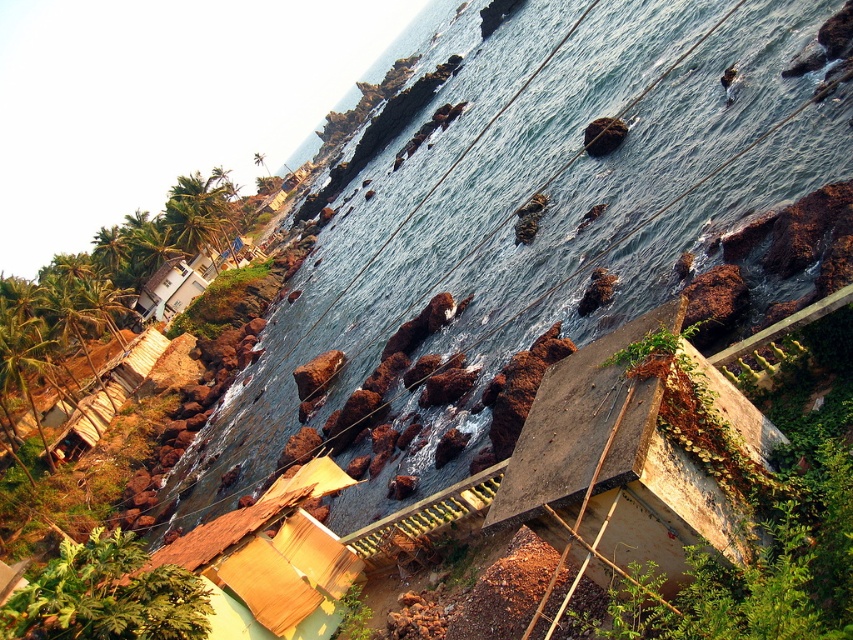
Question: Which point is closer to the camera?

Choices:
 (A) rusty corrugated metal hut at lower right
 (B) brown woven mat at lower left
 (C) white matte house at upper left
 (D) blue water at center

Answer: (A)

Question: In this image, where is rusty corrugated metal hut at lower right located relative to white matte house at upper left?

Choices:
 (A) above
 (B) below

Answer: (B)

Question: Which point is farther to the camera?

Choices:
 (A) brown woven mat at lower left
 (B) white matte house at upper left
 (C) blue water at center

Answer: (B)

Question: Which object is closer to the camera taking this photo?

Choices:
 (A) blue water at center
 (B) white matte house at upper left
 (C) rusty corrugated metal hut at lower right
 (D) brown woven mat at lower left

Answer: (C)

Question: Does brown woven mat at lower left have a greater width compared to white matte house at upper left?

Choices:
 (A) no
 (B) yes

Answer: (A)

Question: Can you confirm if rusty corrugated metal hut at lower right is positioned below white matte house at upper left?

Choices:
 (A) no
 (B) yes

Answer: (B)